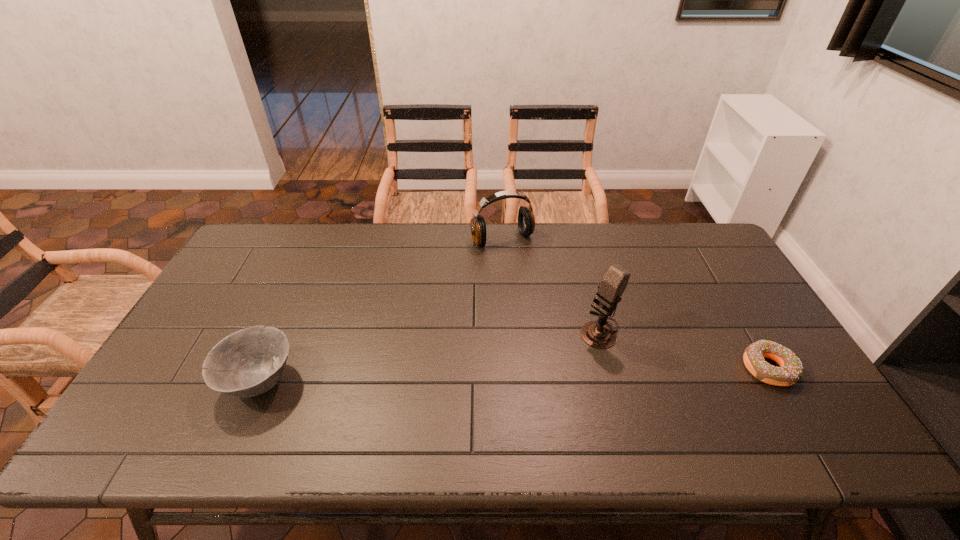
Where is `object situated at the near right corner`? The height and width of the screenshot is (540, 960). object situated at the near right corner is located at coordinates (790, 371).

The height and width of the screenshot is (540, 960). In order to click on vacant space at the far edge in this screenshot , I will do `click(291, 250)`.

Where is `blank space at the near edge of the desktop`? The width and height of the screenshot is (960, 540). blank space at the near edge of the desktop is located at coordinates (681, 400).

At what (x,y) coordinates should I click in order to perform the action: click on vacant space at the left edge of the desktop. Please return your answer as a coordinate pair (x, y). The image size is (960, 540). Looking at the image, I should click on (208, 351).

Where is `vacant point at the right edge`? vacant point at the right edge is located at coordinates (733, 284).

The image size is (960, 540). In order to click on vacant space at the far left corner of the desktop in this screenshot , I will do `click(262, 230)`.

In the image, there is a desktop. At what (x,y) coordinates should I click in order to perform the action: click on free space at the near left corner. Please return your answer as a coordinate pair (x, y). Looking at the image, I should click on (152, 389).

Image resolution: width=960 pixels, height=540 pixels. Find the location of `empty location between the leftmost object and the shortest object`. empty location between the leftmost object and the shortest object is located at coordinates (515, 375).

Locate an element on the screen. The height and width of the screenshot is (540, 960). free space between the second shortest object and the farthest object is located at coordinates (381, 310).

This screenshot has height=540, width=960. I want to click on free space between the farthest object and the third tallest object, so [381, 310].